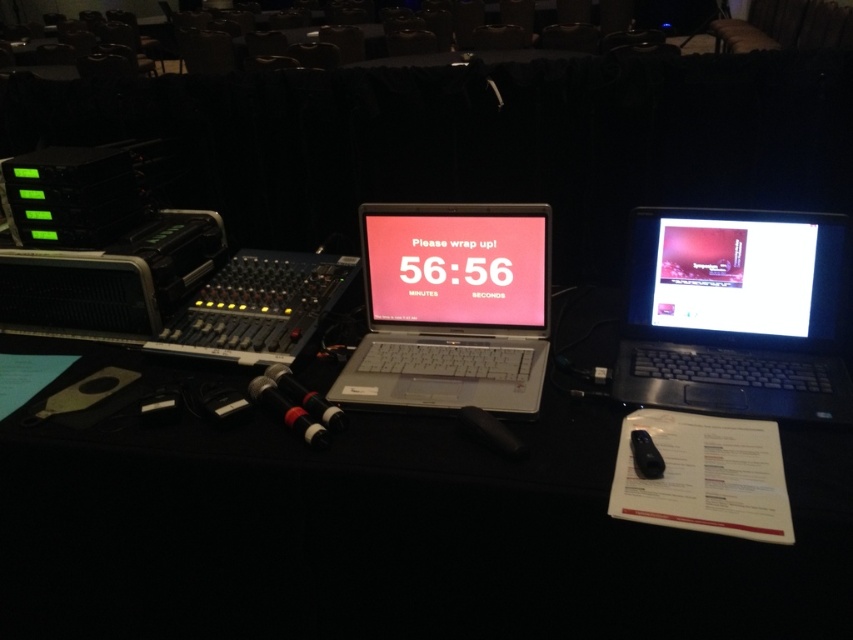
You are setting up for a presentation and need to choose a screen for a slide show. The presentation requires a larger display to ensure the audience can see clearly. Which of the two screens, the pink glossy screen at center or the matte black monitor at right, should you select?

The pink glossy screen at center has a larger size compared to the matte black monitor at right, so you should select the pink glossy screen at center for the slide show to ensure the audience can see clearly.

You are an event organizer checking the setup. You notice a point marked at coordinates (x=457, y=266) on the table. What object is located at that point?

The point at coordinates (x=457, y=266) marks the pink glossy screen at center.